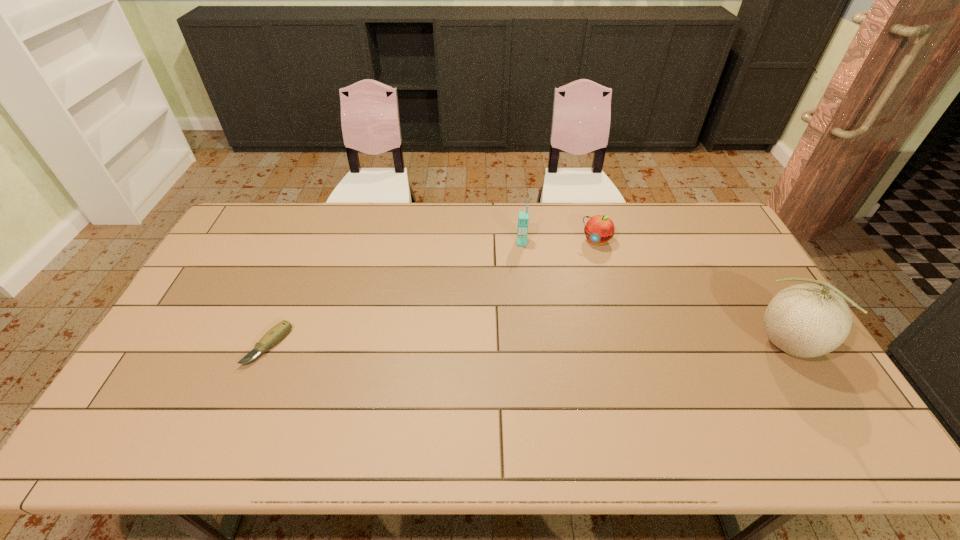
Image resolution: width=960 pixels, height=540 pixels. I want to click on vacant spot on the desktop that is between the pocketknife and the cantaloup and is positioned on the keypad of the cellular telephone, so click(521, 346).

Identify the location of vacant space on the desktop that is between the shortest object and the tallest object and is positioned on the surface of the third tallest object. This screenshot has width=960, height=540. pyautogui.click(x=534, y=346).